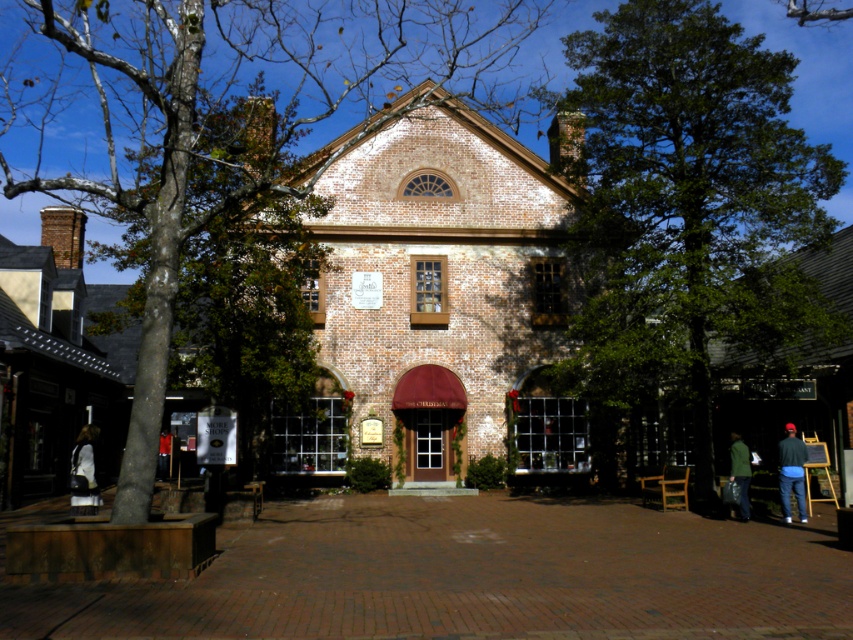
You are a fashion designer observing the scene and want to create a new outfit using the white fabric dress at lower left and dark blue jeans at lower left. Which item has a wider silhouette?

The white fabric dress at lower left has a wider silhouette than the dark blue jeans at lower left, as its width surpasses the jeans.

You are a photographer standing in front of the brick building. You want to capture both the brown textured tree at center and the dark blue jeans at lower left in the same frame. Which object should you focus on first to ensure both are in the shot?

You should focus on the brown textured tree at center first because it is larger and more prominent, ensuring it will be centered and properly framed while the dark blue jeans at lower left will naturally fit into the composition due to its smaller size.